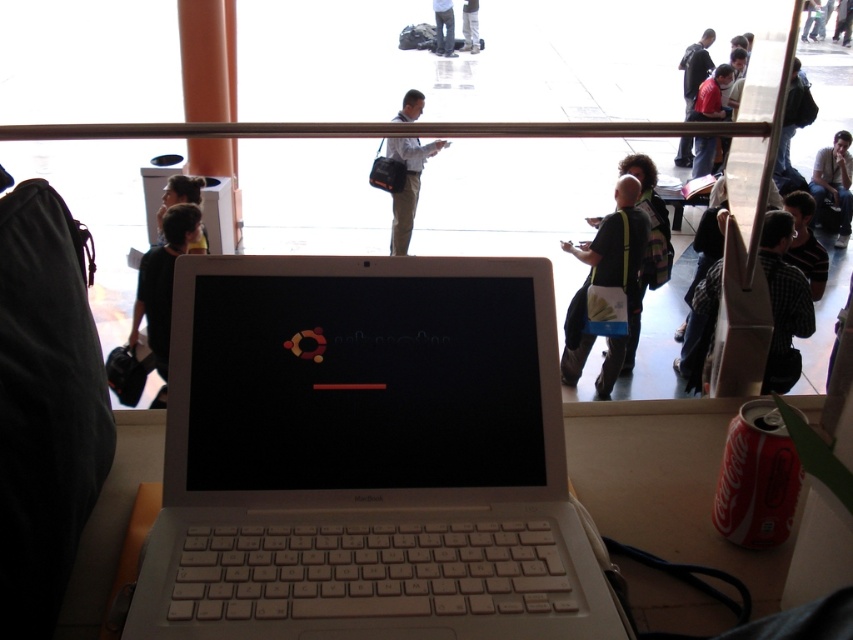
Question: Can you confirm if white plastic laptop at center is positioned above matte black bag at center?

Choices:
 (A) yes
 (B) no

Answer: (B)

Question: Among these points, which one is farthest from the camera?

Choices:
 (A) [x=625, y=260]
 (B) [x=173, y=221]
 (C) [x=751, y=480]

Answer: (A)

Question: Is dark brown hair at upper left to the right of white fabric pants at center from the viewer's perspective?

Choices:
 (A) yes
 (B) no

Answer: (B)

Question: Which point is closer to the camera?

Choices:
 (A) (686, 148)
 (B) (709, 144)
 (C) (828, 198)

Answer: (C)

Question: Which point appears farthest from the camera in this image?

Choices:
 (A) (143, 253)
 (B) (694, 76)
 (C) (204, 232)
 (D) (415, 525)

Answer: (B)

Question: Can you confirm if black striped shirt at right is thinner than light brown leather jacket at upper right?

Choices:
 (A) no
 (B) yes

Answer: (A)